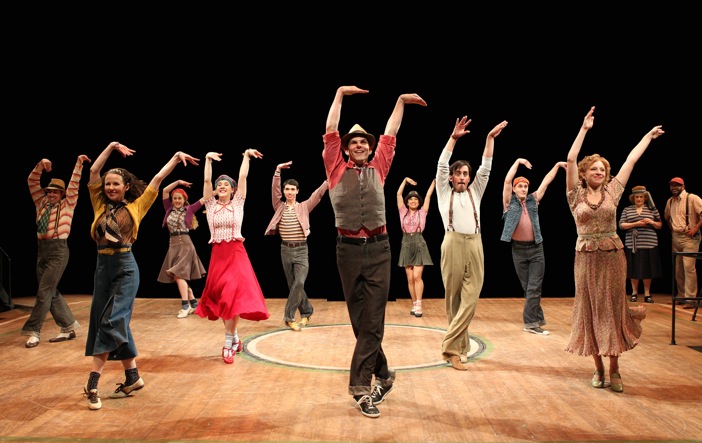
Where is `sock`? sock is located at coordinates (93, 378), (128, 372), (182, 304), (190, 302), (225, 342), (236, 338), (418, 305), (410, 308).